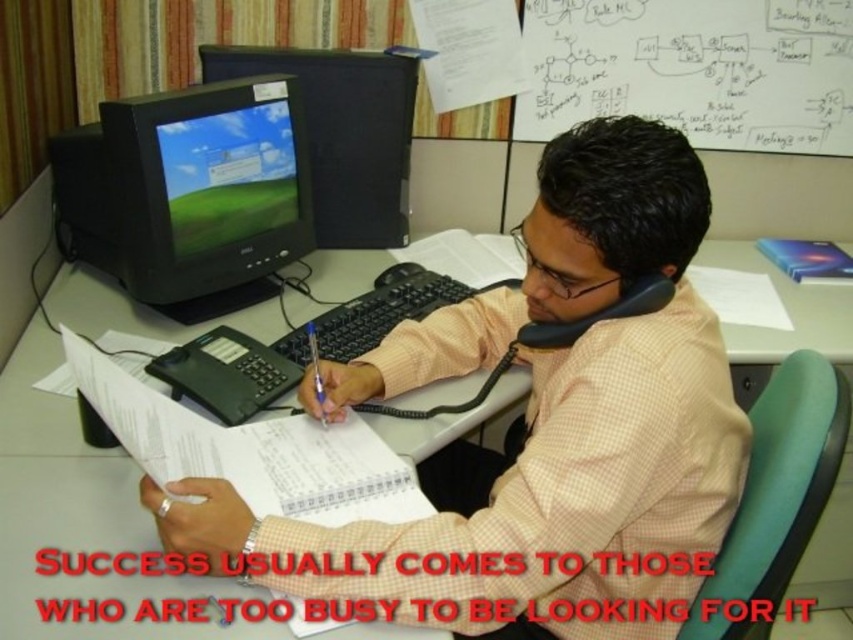
You are a photographer taking a picture of the workspace scene. You notice the pink checkered shirt at center and the white paper at lower center. Which object is closer to your camera lens?

The pink checkered shirt at center is closer to the camera lens because it is further to the viewer than the white paper at lower center.

You are an assistant who needs to determine if the pink checkered shirt at center can be placed on top of the white paper at lower center without folding it. Based on their sizes, is this possible?

The pink checkered shirt at center might be wider than white paper at lower center, so there is a possibility that the shirt will not fit entirely on the paper without folding.

You are organizing the desk and need to place the white paper at lower center and the blue plastic pen at center into a drawer. The drawer has limited space. Based on their sizes, which item should you place first to maximize space efficiency?

The white paper at lower center occupies less space than the blue plastic pen at center, so you should place the blue plastic pen at center first to make room for the smaller item.